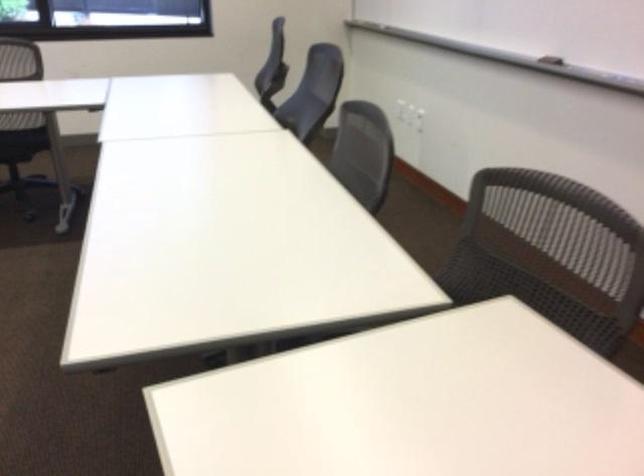
Describe the element at coordinates (22, 143) in the screenshot. The height and width of the screenshot is (476, 644). I see `the black chair sitting surface` at that location.